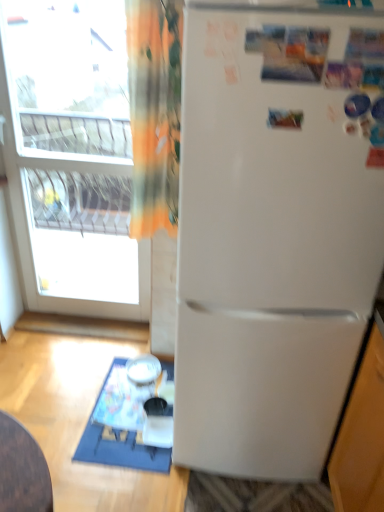
Question: From a real-world perspective, is white glossy bowl at lower center physically located above or below transparent glass window at upper left?

Choices:
 (A) below
 (B) above

Answer: (A)

Question: Relative to transparent glass window at upper left, is white glossy bowl at lower center in front or behind?

Choices:
 (A) front
 (B) behind

Answer: (B)

Question: Considering the real-world distances, which object is closest to the white matte refrigerator at center?

Choices:
 (A) transparent glass window at upper left
 (B) white plastic table at lower left
 (C) white glossy bowl at lower center
 (D) orange fabric curtain at upper left

Answer: (D)

Question: Which object is positioned closest to the orange fabric curtain at upper left?

Choices:
 (A) white matte refrigerator at center
 (B) white plastic table at lower left
 (C) transparent glass window at upper left
 (D) white glossy bowl at lower center

Answer: (A)